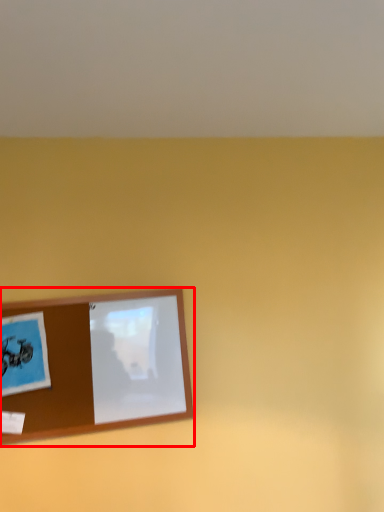
Question: From the image's perspective, what is the correct spatial relationship of picture frame (annotated by the red box) in relation to postcard?

Choices:
 (A) below
 (B) above

Answer: (A)